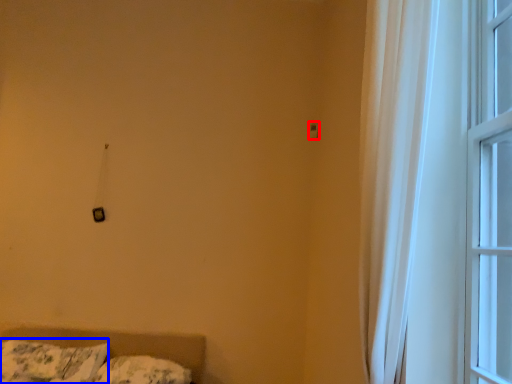
Question: Which object is closer to the camera taking this photo, light switch (highlighted by a red box) or pillow (highlighted by a blue box)?

Choices:
 (A) light switch
 (B) pillow

Answer: (B)